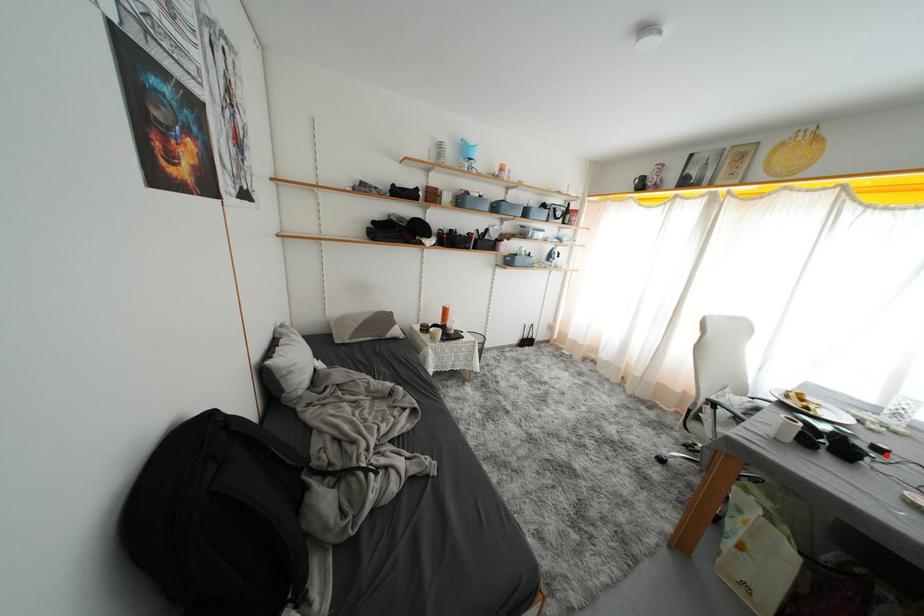
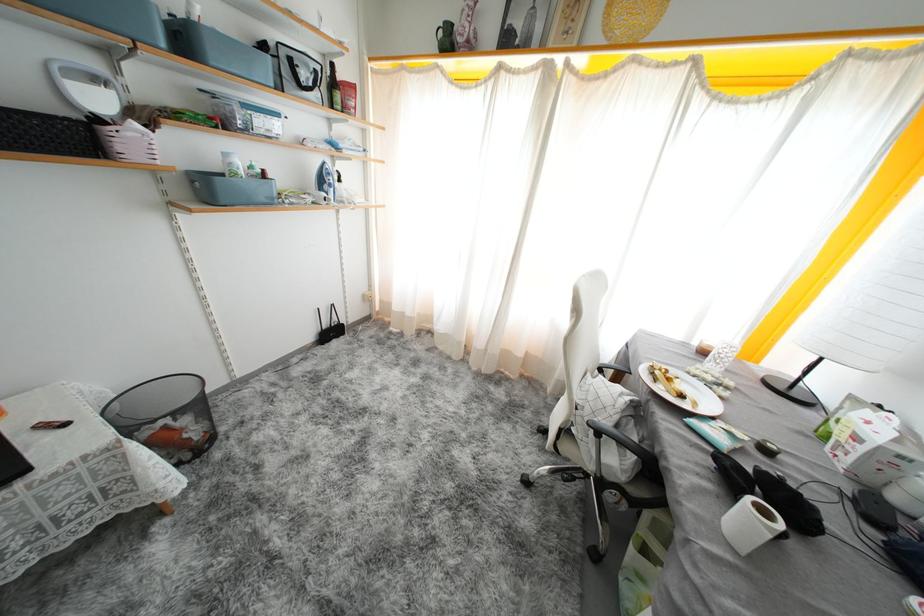
Where in the second image is the point corresponding to the highlighted location from the first image?

(773, 455)